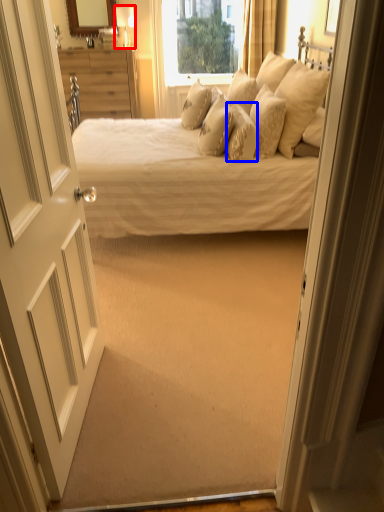
Question: Which of the following is the farthest to the observer, lamp (highlighted by a red box) or pillow (highlighted by a blue box)?

Choices:
 (A) lamp
 (B) pillow

Answer: (A)